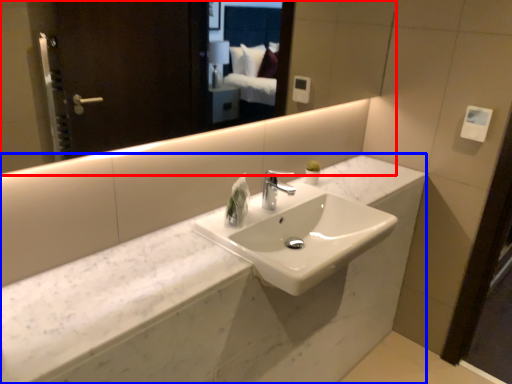
Question: Which object is further to the camera taking this photo, mirror (highlighted by a red box) or counter (highlighted by a blue box)?

Choices:
 (A) mirror
 (B) counter

Answer: (B)